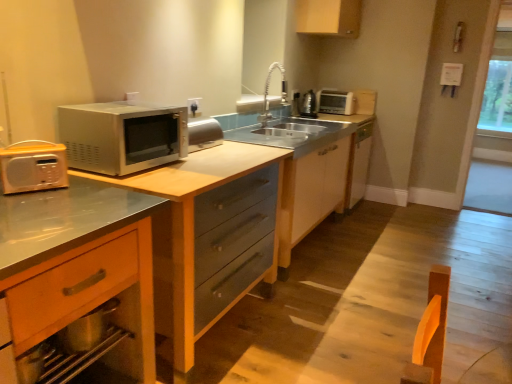
Question: Can you confirm if metallic silver microwave at left is thinner than satin nickel faucet at center?

Choices:
 (A) yes
 (B) no

Answer: (B)

Question: Is there a large distance between metallic silver microwave at left and satin nickel faucet at center?

Choices:
 (A) yes
 (B) no

Answer: (A)

Question: Can you confirm if metallic silver microwave at left is taller than satin nickel faucet at center?

Choices:
 (A) no
 (B) yes

Answer: (B)

Question: Would you say metallic silver microwave at left contains satin nickel faucet at center?

Choices:
 (A) no
 (B) yes

Answer: (A)

Question: Can you confirm if metallic silver microwave at left is positioned to the right of satin nickel faucet at center?

Choices:
 (A) yes
 (B) no

Answer: (B)

Question: Based on their sizes in the image, would you say matte wood cabinet at upper center, marked as the 2th cabinetry in a right-to-left arrangement, is bigger or smaller than satin nickel faucet at center?

Choices:
 (A) small
 (B) big

Answer: (B)

Question: Is matte wood cabinet at upper center, placed as the second cabinetry when sorted from left to right, in front of or behind satin nickel faucet at center in the image?

Choices:
 (A) front
 (B) behind

Answer: (B)

Question: In terms of width, does matte wood cabinet at upper center, acting as the first cabinetry starting from the top, look wider or thinner when compared to satin nickel faucet at center?

Choices:
 (A) thin
 (B) wide

Answer: (B)

Question: From a real-world perspective, is matte wood cabinet at upper center, arranged as the third cabinetry when ordered from the bottom, positioned above or below satin nickel faucet at center?

Choices:
 (A) above
 (B) below

Answer: (A)

Question: In the image, is satin nickel faucet at center positioned in front of or behind wooden drawer at lower left, positioned as the 3th cabinetry in top-to-bottom order?

Choices:
 (A) front
 (B) behind

Answer: (B)

Question: Based on their sizes in the image, would you say satin nickel faucet at center is bigger or smaller than wooden drawer at lower left, the first cabinetry positioned from the front?

Choices:
 (A) small
 (B) big

Answer: (A)

Question: In terms of height, does satin nickel faucet at center look taller or shorter compared to wooden drawer at lower left, the first cabinetry positioned from the front?

Choices:
 (A) short
 (B) tall

Answer: (A)

Question: In the image, is satin nickel faucet at center on the left side or the right side of wooden drawer at lower left, the 1th cabinetry positioned from the bottom?

Choices:
 (A) right
 (B) left

Answer: (A)

Question: Is metallic silver kettle at upper right bigger or smaller than transparent glass window at right, which is counted as the first window screen, starting from the left?

Choices:
 (A) small
 (B) big

Answer: (A)

Question: In terms of width, does metallic silver kettle at upper right look wider or thinner when compared to transparent glass window at right, which is the 2th window screen in right-to-left order?

Choices:
 (A) thin
 (B) wide

Answer: (B)